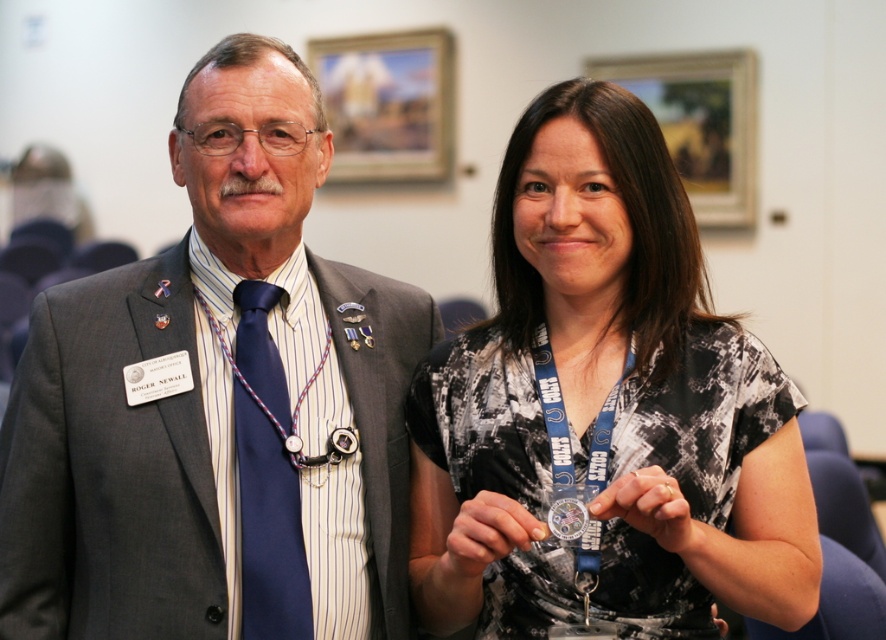
Question: Which point is farther to the camera?

Choices:
 (A) (496, 221)
 (B) (131, 323)

Answer: (A)

Question: Where is matte gray suit at center located in relation to printed fabric shirt at center in the image?

Choices:
 (A) above
 (B) below

Answer: (A)

Question: Which point is farther to the camera?

Choices:
 (A) matte gray suit at center
 (B) printed fabric shirt at center

Answer: (A)

Question: Can you confirm if matte gray suit at center is wider than printed fabric shirt at center?

Choices:
 (A) yes
 (B) no

Answer: (A)

Question: Is matte gray suit at center wider than printed fabric shirt at center?

Choices:
 (A) no
 (B) yes

Answer: (B)